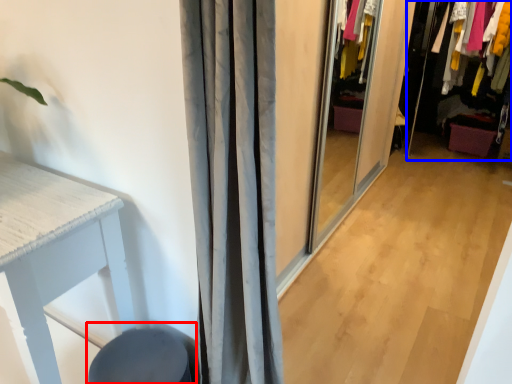
Question: Which point is further to the camera, swivel chair (highlighted by a red box) or closet (highlighted by a blue box)?

Choices:
 (A) swivel chair
 (B) closet

Answer: (B)